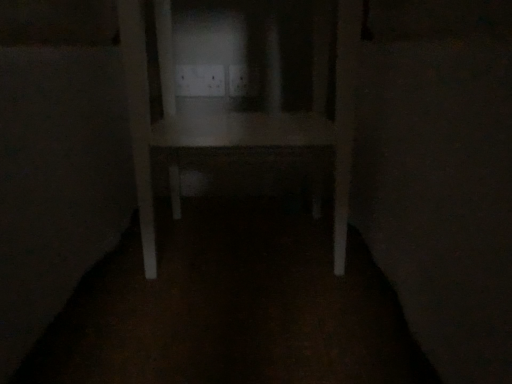
Where is `white plastic electric outlet at center, the 2th electric outlet in the right-to-left sequence`? The width and height of the screenshot is (512, 384). white plastic electric outlet at center, the 2th electric outlet in the right-to-left sequence is located at coordinates (200, 80).

Where is `white matte table at center`? Image resolution: width=512 pixels, height=384 pixels. white matte table at center is located at coordinates (239, 112).

The width and height of the screenshot is (512, 384). What are the coordinates of `white plastic electric outlet at center, which is the 1th electric outlet in left-to-right order` in the screenshot? It's located at (200, 80).

Who is smaller, white plastic electric outlet at center, positioned as the second electric outlet in left-to-right order, or white matte table at center?

white plastic electric outlet at center, positioned as the second electric outlet in left-to-right order, is smaller.

Does white plastic electric outlet at center, which appears as the first electric outlet when viewed from the right, have a lesser height compared to white matte table at center?

Yes, white plastic electric outlet at center, which appears as the first electric outlet when viewed from the right, is shorter than white matte table at center.

Measure the distance from white plastic electric outlet at center, positioned as the second electric outlet in left-to-right order, to white matte table at center.

white plastic electric outlet at center, positioned as the second electric outlet in left-to-right order, is 13.43 inches away from white matte table at center.

Is white plastic electric outlet at center, positioned as the second electric outlet in left-to-right order, far from white matte table at center?

white plastic electric outlet at center, positioned as the second electric outlet in left-to-right order, is actually quite close to white matte table at center.

From a real-world perspective, is white matte table at center positioned over white plastic electric outlet at center, which is the 1th electric outlet in left-to-right order, based on gravity?

Actually, white matte table at center is physically below white plastic electric outlet at center, which is the 1th electric outlet in left-to-right order, in the real world.

Looking at this image, considering their positions, is white matte table at center located in front of or behind white plastic electric outlet at center, which is the 1th electric outlet in left-to-right order?

white matte table at center is in front of white plastic electric outlet at center, which is the 1th electric outlet in left-to-right order.

Who is smaller, white matte table at center or white plastic electric outlet at center, which is the 1th electric outlet in left-to-right order?

With smaller size is white plastic electric outlet at center, which is the 1th electric outlet in left-to-right order.

Is white matte table at center to the left or to the right of white plastic electric outlet at center, the 2th electric outlet in the right-to-left sequence, in the image?

Clearly, white matte table at center is on the right of white plastic electric outlet at center, the 2th electric outlet in the right-to-left sequence, in the image.

From a real-world perspective, is white plastic electric outlet at center, which is the 1th electric outlet in left-to-right order, above or below white plastic electric outlet at center, positioned as the second electric outlet in left-to-right order?

white plastic electric outlet at center, which is the 1th electric outlet in left-to-right order, is situated lower than white plastic electric outlet at center, positioned as the second electric outlet in left-to-right order, in the real world.

I want to click on electric outlet above the white plastic electric outlet at center, the 2th electric outlet in the right-to-left sequence (from a real-world perspective), so click(244, 80).

Between white plastic electric outlet at center, the 2th electric outlet in the right-to-left sequence, and white plastic electric outlet at center, which appears as the first electric outlet when viewed from the right, which one is positioned behind?

white plastic electric outlet at center, the 2th electric outlet in the right-to-left sequence.

Does white plastic electric outlet at center, the 2th electric outlet in the right-to-left sequence, turn towards white plastic electric outlet at center, positioned as the second electric outlet in left-to-right order?

No, white plastic electric outlet at center, the 2th electric outlet in the right-to-left sequence, does not turn towards white plastic electric outlet at center, positioned as the second electric outlet in left-to-right order.

Does white matte table at center have a lesser height compared to white plastic electric outlet at center, which appears as the first electric outlet when viewed from the right?

No.

Based on the photo, is white matte table at center looking in the opposite direction of white plastic electric outlet at center, positioned as the second electric outlet in left-to-right order?

Correct, white matte table at center is looking away from white plastic electric outlet at center, positioned as the second electric outlet in left-to-right order.

From the picture: Can we say white matte table at center lies outside white plastic electric outlet at center, which appears as the first electric outlet when viewed from the right?

Yes, white matte table at center is located beyond the bounds of white plastic electric outlet at center, which appears as the first electric outlet when viewed from the right.

Which object is wider, white plastic electric outlet at center, the 2th electric outlet in the right-to-left sequence, or white matte table at center?

With larger width is white matte table at center.

How distant is white plastic electric outlet at center, which is the 1th electric outlet in left-to-right order, from white matte table at center?

white plastic electric outlet at center, which is the 1th electric outlet in left-to-right order, is 32.25 centimeters from white matte table at center.

Is white plastic electric outlet at center, the 2th electric outlet in the right-to-left sequence, with white matte table at center?

No, white plastic electric outlet at center, the 2th electric outlet in the right-to-left sequence, is not in contact with white matte table at center.

Can you confirm if white plastic electric outlet at center, the 2th electric outlet in the right-to-left sequence, is bigger than white matte table at center?

No.

Is white plastic electric outlet at center, positioned as the second electric outlet in left-to-right order, not close to white plastic electric outlet at center, which is the 1th electric outlet in left-to-right order?

No, white plastic electric outlet at center, positioned as the second electric outlet in left-to-right order, is not far away from white plastic electric outlet at center, which is the 1th electric outlet in left-to-right order.

Which is in front, white plastic electric outlet at center, which appears as the first electric outlet when viewed from the right, or white plastic electric outlet at center, which is the 1th electric outlet in left-to-right order?

white plastic electric outlet at center, which appears as the first electric outlet when viewed from the right, is more forward.

Is white plastic electric outlet at center, positioned as the second electric outlet in left-to-right order, turned away from white plastic electric outlet at center, which is the 1th electric outlet in left-to-right order?

No, white plastic electric outlet at center, positioned as the second electric outlet in left-to-right order, is not facing away from white plastic electric outlet at center, which is the 1th electric outlet in left-to-right order.

Image resolution: width=512 pixels, height=384 pixels. In order to click on furniture that is below the white plastic electric outlet at center, which appears as the first electric outlet when viewed from the right (from the image's perspective) in this screenshot , I will do [x=239, y=112].

Where is `electric outlet that is the 1st object located above the white matte table at center (from the image's perspective)`? electric outlet that is the 1st object located above the white matte table at center (from the image's perspective) is located at coordinates (200, 80).

In the scene shown: Which object lies nearer to the anchor point white plastic electric outlet at center, which appears as the first electric outlet when viewed from the right, white matte table at center or white plastic electric outlet at center, the 2th electric outlet in the right-to-left sequence?

white plastic electric outlet at center, the 2th electric outlet in the right-to-left sequence.

Estimate the real-world distances between objects in this image. Which object is closer to white plastic electric outlet at center, positioned as the second electric outlet in left-to-right order, white plastic electric outlet at center, which is the 1th electric outlet in left-to-right order, or white matte table at center?

white plastic electric outlet at center, which is the 1th electric outlet in left-to-right order.

Based on their spatial positions, is white plastic electric outlet at center, which is the 1th electric outlet in left-to-right order, or white plastic electric outlet at center, positioned as the second electric outlet in left-to-right order, further from white matte table at center?

white plastic electric outlet at center, positioned as the second electric outlet in left-to-right order, is further to white matte table at center.

Considering their positions, is white matte table at center positioned further to white plastic electric outlet at center, the 2th electric outlet in the right-to-left sequence, than white plastic electric outlet at center, which appears as the first electric outlet when viewed from the right?

white matte table at center.

When comparing their distances from white plastic electric outlet at center, the 2th electric outlet in the right-to-left sequence, does white plastic electric outlet at center, which appears as the first electric outlet when viewed from the right, or white matte table at center seem closer?

Among the two, white plastic electric outlet at center, which appears as the first electric outlet when viewed from the right, is located nearer to white plastic electric outlet at center, the 2th electric outlet in the right-to-left sequence.

Based on the photo, looking at the image, which one is located further to white matte table at center, white plastic electric outlet at center, positioned as the second electric outlet in left-to-right order, or white plastic electric outlet at center, which is the 1th electric outlet in left-to-right order?

white plastic electric outlet at center, positioned as the second electric outlet in left-to-right order, lies further to white matte table at center than the other object.

Identify the location of electric outlet between white matte table at center and white plastic electric outlet at center, which is the 1th electric outlet in left-to-right order, from front to back. (244, 80).